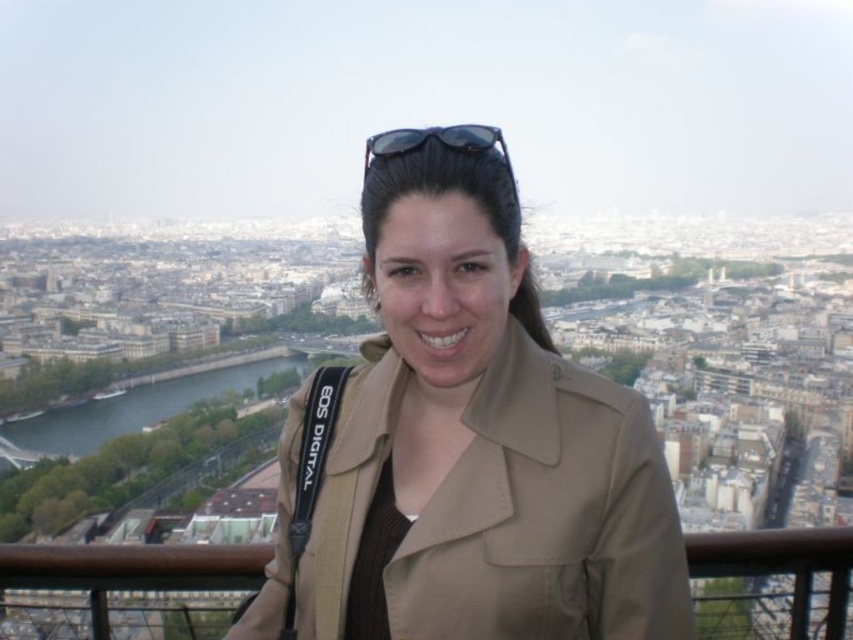
Question: Among these objects, which one is farthest from the camera?

Choices:
 (A) tan fabric jacket at center
 (B) sunglasses at center

Answer: (B)

Question: Does tan fabric jacket at center have a greater width compared to sunglasses at center?

Choices:
 (A) yes
 (B) no

Answer: (A)

Question: Which point is farther to the camera?

Choices:
 (A) tan fabric jacket at center
 (B) sunglasses at center

Answer: (B)

Question: Does tan fabric jacket at center have a greater width compared to sunglasses at center?

Choices:
 (A) no
 (B) yes

Answer: (B)

Question: Can you confirm if tan fabric jacket at center is positioned above sunglasses at center?

Choices:
 (A) no
 (B) yes

Answer: (A)